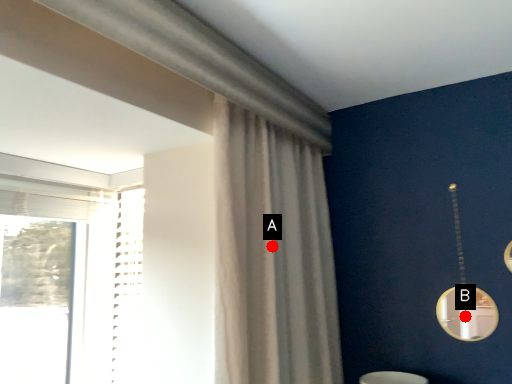
Question: Two points are circled on the image, labeled by A and B beside each circle. Among these points, which one is farthest from the camera?

Choices:
 (A) A is further
 (B) B is further

Answer: (B)